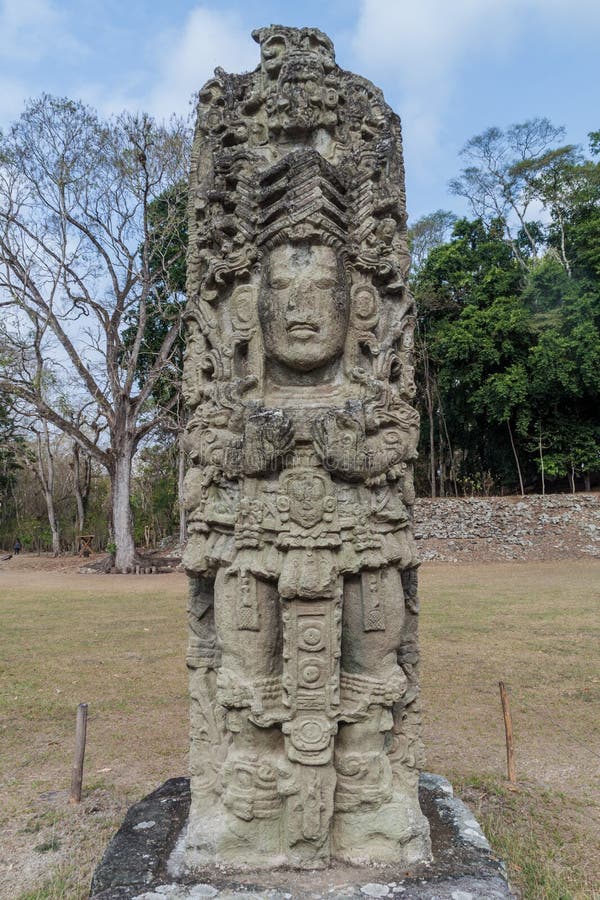
You are a GUI agent. You are given a task and a screenshot of the screen. Output one action in this format:
    pyautogui.click(x=<x>, y=<y>)
    Task: Click on the statue base
    This screenshot has height=900, width=600.
    Given the screenshot: What is the action you would take?
    pyautogui.click(x=150, y=828), pyautogui.click(x=303, y=894), pyautogui.click(x=448, y=842)